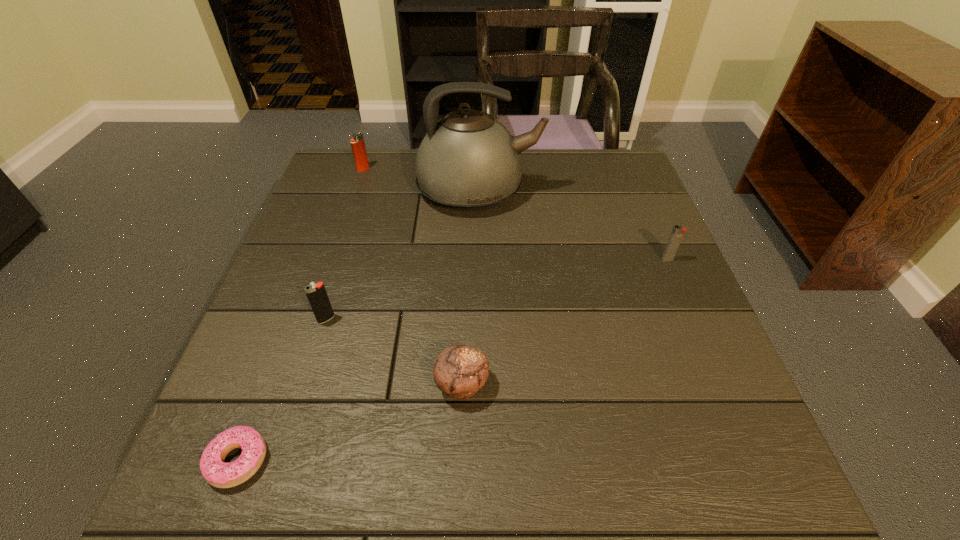
You are a GUI agent. You are given a task and a screenshot of the screen. Output one action in this format:
    pyautogui.click(x=<x>, y=<y>)
    Task: Click on the vacant space that's between the third nearest object and the kettle
    The height and width of the screenshot is (540, 960).
    Given the screenshot: What is the action you would take?
    pyautogui.click(x=403, y=255)

This screenshot has width=960, height=540. What are the coordinates of `vacant point located between the rightmost object and the farthest igniter` in the screenshot? It's located at (516, 214).

I want to click on blank region between the tallest object and the nearest object, so click(359, 326).

The height and width of the screenshot is (540, 960). In order to click on vacant area that lies between the farthest igniter and the muffin in this screenshot , I will do `click(413, 276)`.

Find the location of a particular element. This screenshot has height=540, width=960. vacant point located between the nearest igniter and the tallest object is located at coordinates (403, 255).

This screenshot has width=960, height=540. I want to click on free space between the fourth nearest object and the kettle, so click(x=573, y=225).

Locate an element on the screen. The image size is (960, 540). free space between the tallest object and the shortest object is located at coordinates (359, 326).

The width and height of the screenshot is (960, 540). Find the location of `unoccupied area between the farthest igniter and the muffin`. unoccupied area between the farthest igniter and the muffin is located at coordinates (413, 276).

Locate which object ranks third in proximity to the fifth farthest object. Please provide its 2D coordinates. Your answer should be formatted as a tuple, i.e. [(x, y)], where the tuple contains the x and y coordinates of a point satisfying the conditions above.

[(468, 161)]

The image size is (960, 540). Identify the location of object that is the second closest one to the doughnut. (460, 371).